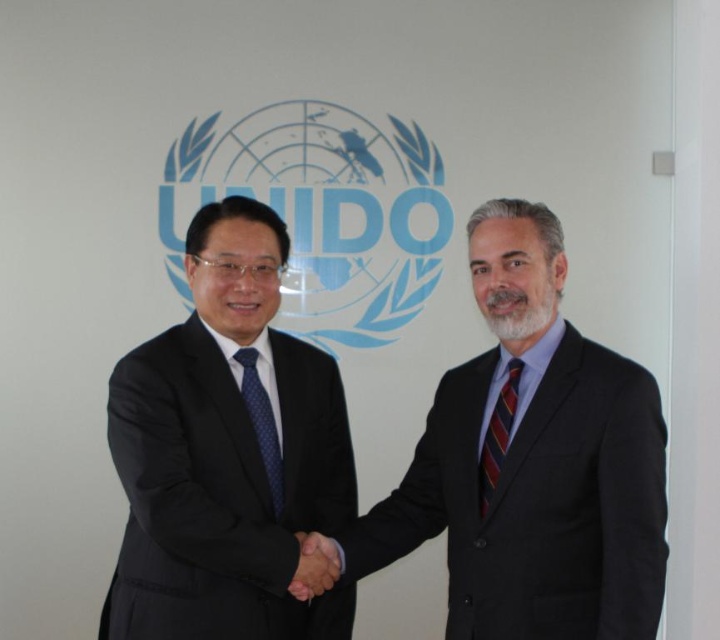
You are standing in front of the UNIDO backdrop and need to identify the position of the black suit at left. Can you determine if it is closer to the top or bottom of the image?

The black suit at left is located at point coordinates with a y value of 0.317, which places it closer to the bottom of the image since lower y values are typically closer to the bottom in coordinate systems.

Based on the scene description, can you determine if the black suit at left is wider than the striped silk tie at right?

The black suit at left is wider than striped silk tie at right according to the description.